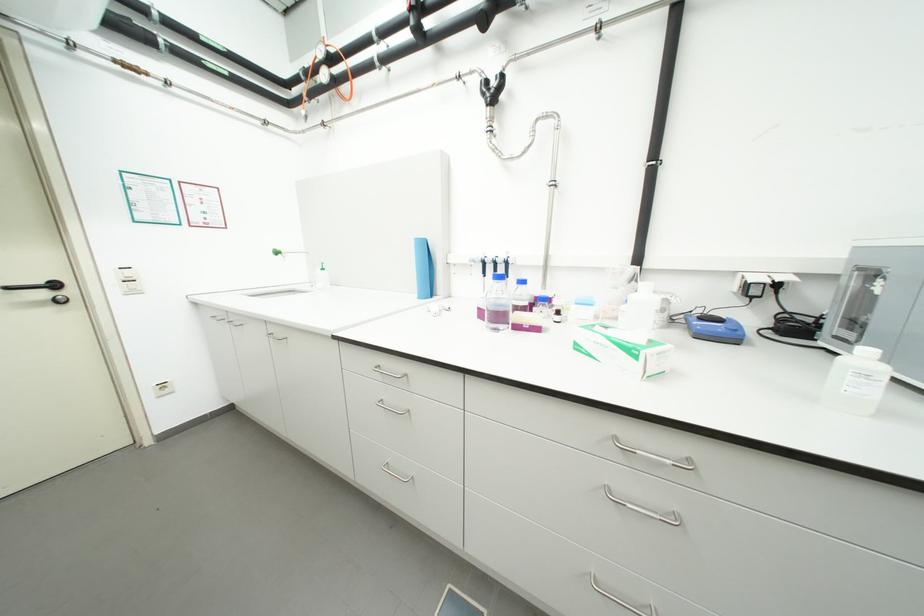
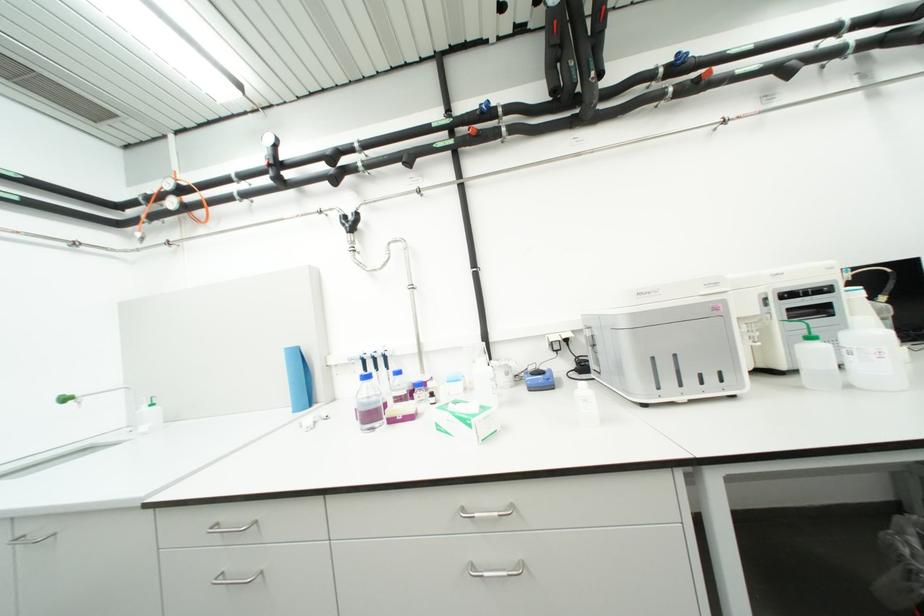
Locate, in the second image, the point that corresponds to [525,329] in the first image.

(399, 422)